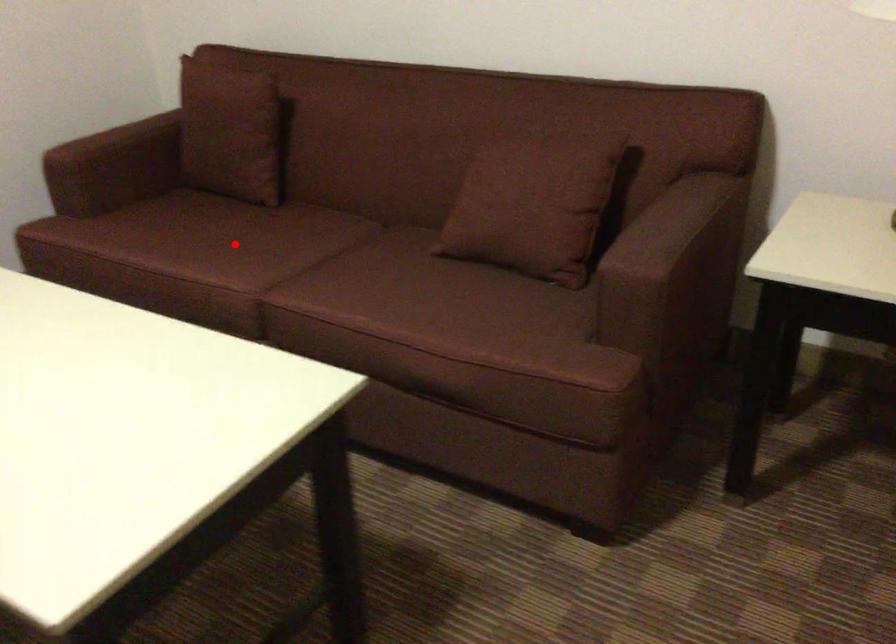
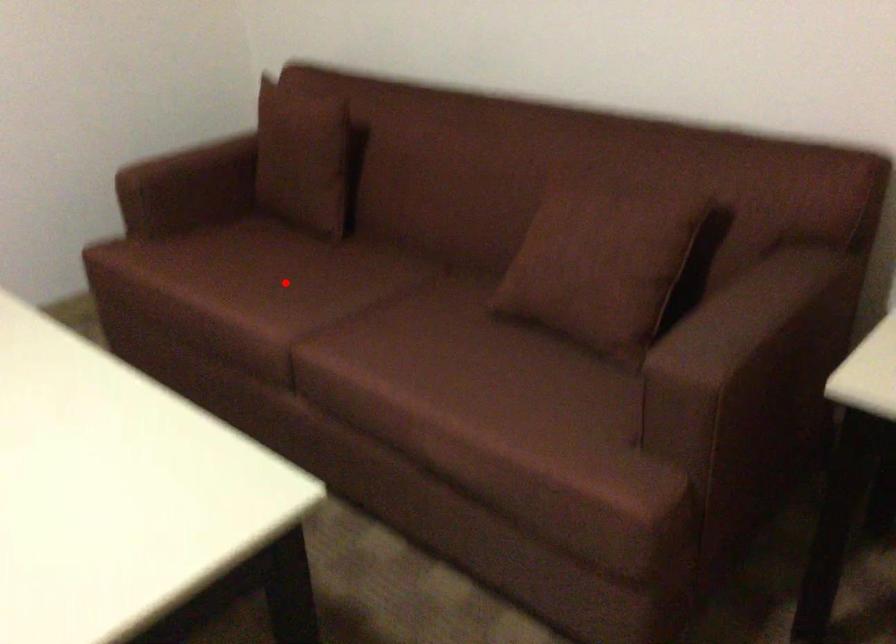
I am providing you with two images of the same scene from different viewpoints. A red point is marked on the first image and another point is marked on the second image. Do the highlighted points in image1 and image2 indicate the same real-world spot?

Yes